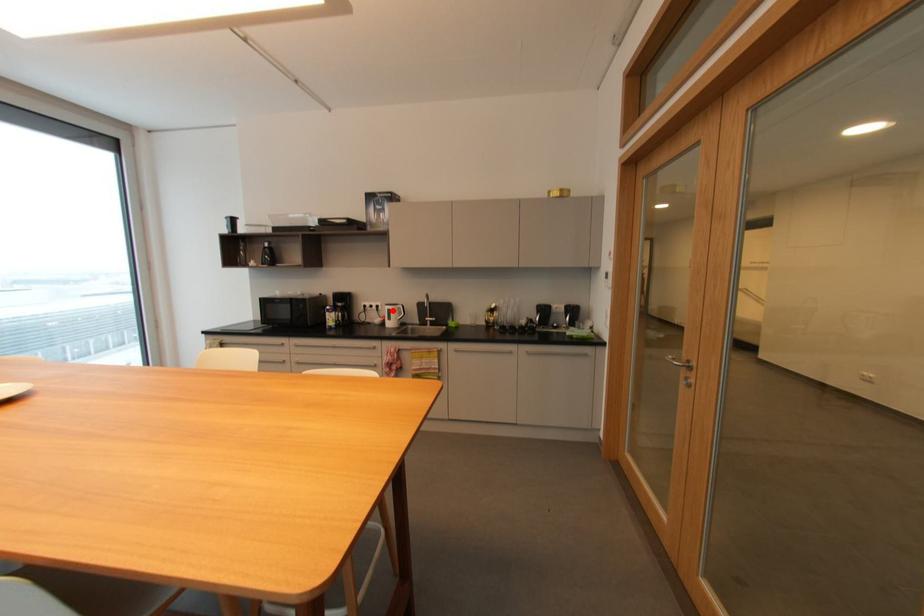
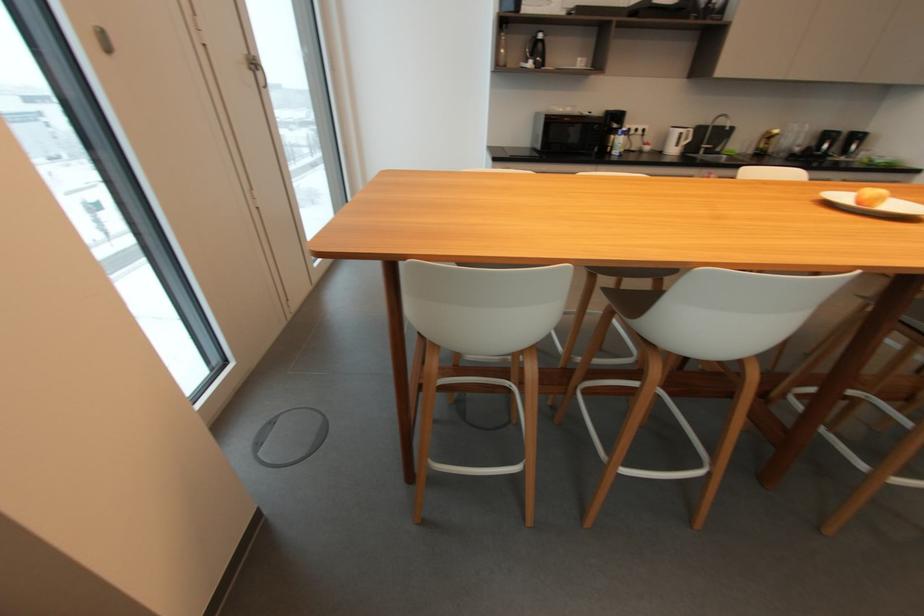
In the second image, find the point that corresponds to the highlighted location in the first image.

(685, 134)